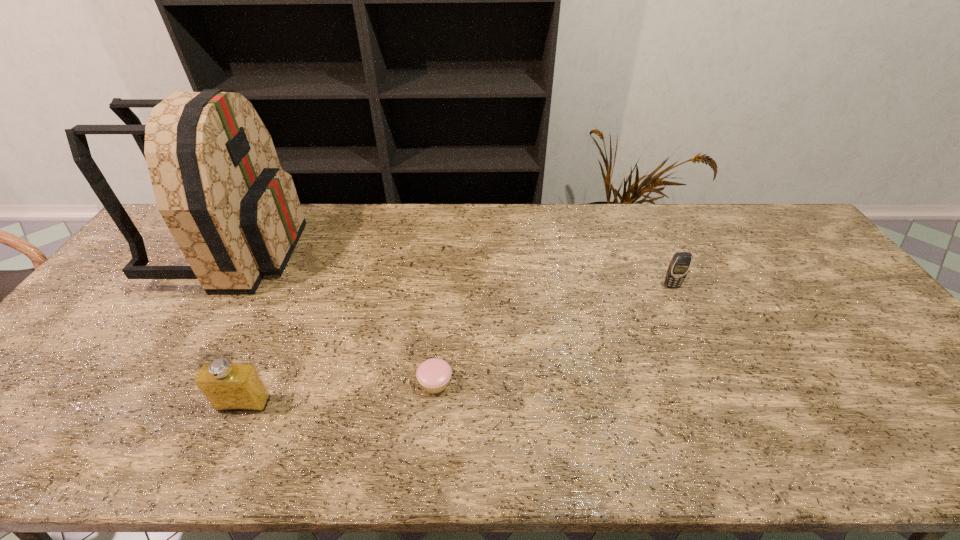
The height and width of the screenshot is (540, 960). Identify the location of object that is at the far edge. 235,214.

Where is `object that is at the left edge`? The image size is (960, 540). object that is at the left edge is located at coordinates [x=235, y=214].

The image size is (960, 540). I want to click on object positioned at the far left corner, so click(x=235, y=214).

Find the location of a particular element. This screenshot has width=960, height=540. vacant space at the far edge is located at coordinates (510, 225).

The image size is (960, 540). Identify the location of vacant space at the near edge of the desktop. (406, 434).

The width and height of the screenshot is (960, 540). Find the location of `free space at the left edge of the desktop`. free space at the left edge of the desktop is located at coordinates (89, 388).

Locate an element on the screen. blank space at the near left corner is located at coordinates (58, 428).

Find the location of a particular element. free space at the far right corner of the desktop is located at coordinates (774, 213).

This screenshot has height=540, width=960. What are the coordinates of `free space between the rightmost object and the tallest object` in the screenshot? It's located at (453, 268).

Locate an element on the screen. This screenshot has width=960, height=540. free point between the shortest object and the second tallest object is located at coordinates (339, 393).